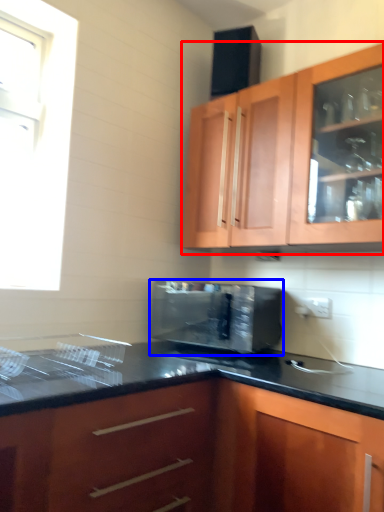
Question: Which of the following is the farthest to the observer, cabinetry (highlighted by a red box) or microwave oven (highlighted by a blue box)?

Choices:
 (A) cabinetry
 (B) microwave oven

Answer: (B)